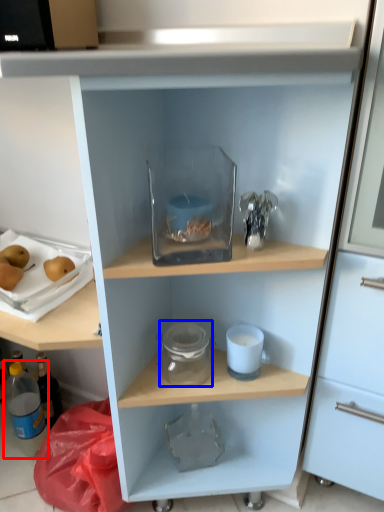
Question: Which object appears closest to the camera in this image, bottle (highlighted by a red box) or glass jar (highlighted by a blue box)?

Choices:
 (A) bottle
 (B) glass jar

Answer: (B)